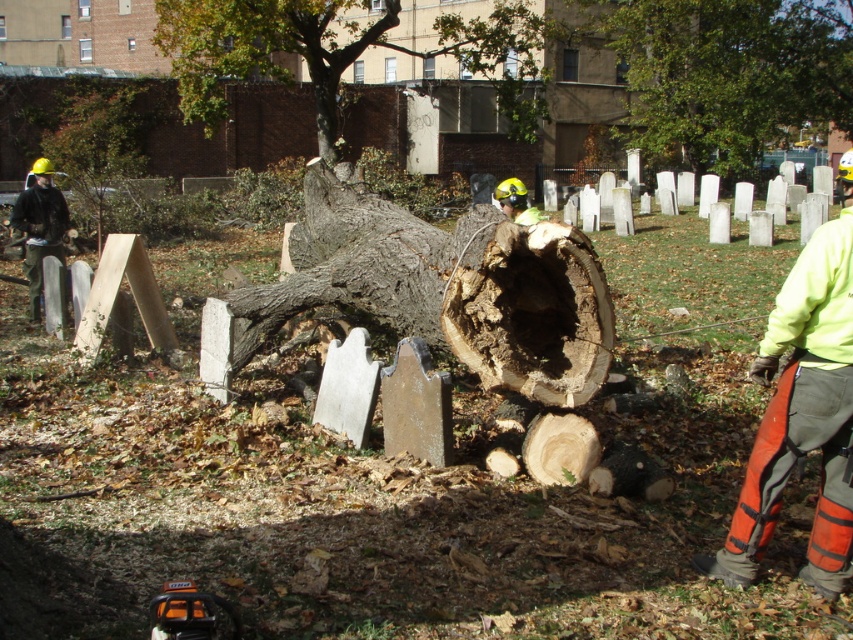
You are a visitor who just arrived at the cemetery and notice the neon yellow jacket at right and the green leafy tree at upper center. Which object is nearer to you?

The neon yellow jacket at right is closer to the viewer than the green leafy tree at upper center.

You are a worker in the cemetery and you need to move the neon yellow jacket at right to a safe location. Which direction should you move it so it is not under the green leafy tree at center?

The green leafy tree at center is above the neon yellow jacket at right, so to move it to a safe location, you should move the neon yellow jacket at right away from under the green leafy tree at center, likely to the left or behind the tree where it won

How far apart are the green leafy tree at center and the large tree trunk lying horizontally across the gravestones?

The green leafy tree at center and the large tree trunk lying horizontally across the gravestones are 94.77 feet apart.